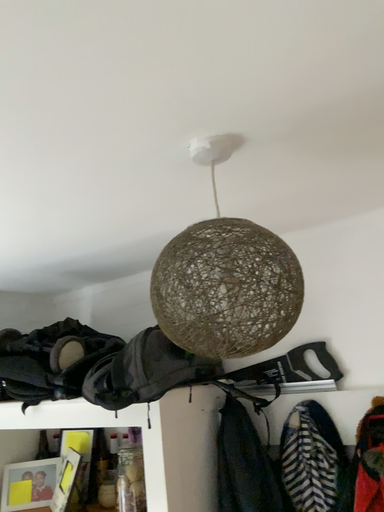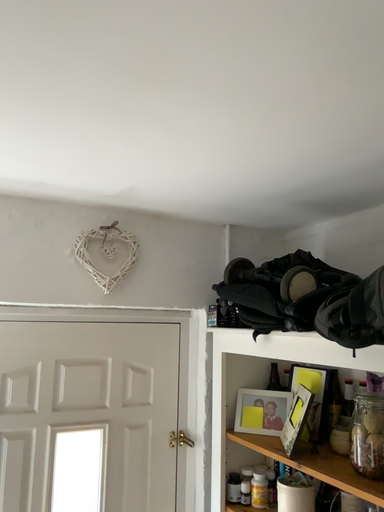
Question: Which way did the camera rotate in the video?

Choices:
 (A) rotated downward
 (B) rotated upward

Answer: (A)